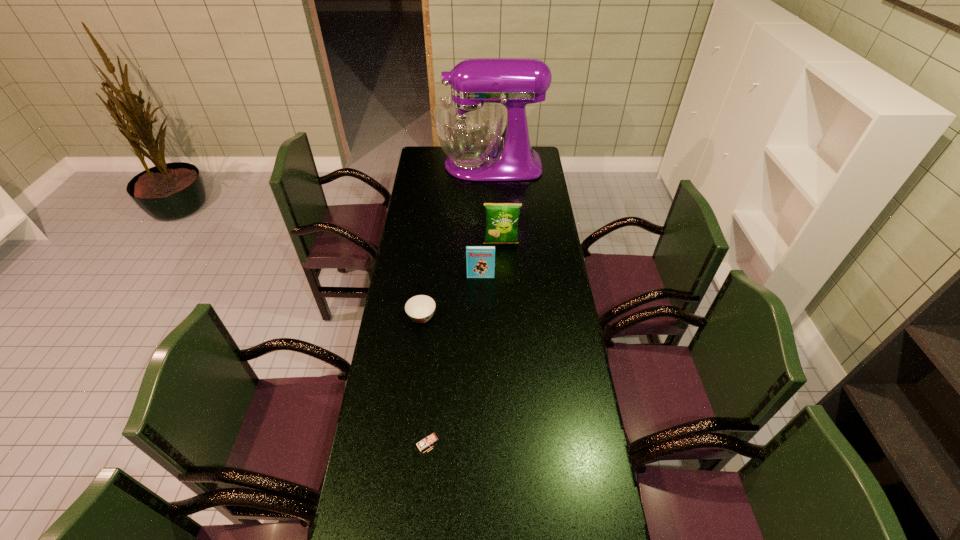
You are a GUI agent. You are given a task and a screenshot of the screen. Output one action in this format:
    pyautogui.click(x=<x>, y=<y>)
    Task: Click on the free location located 0.100m at the bowl opening of the farthest object
    Image resolution: width=960 pixels, height=540 pixels.
    Given the screenshot: What is the action you would take?
    pyautogui.click(x=420, y=165)

The width and height of the screenshot is (960, 540). Identify the location of free point located 0.090m at the bowl opening of the farthest object. (421, 165).

The width and height of the screenshot is (960, 540). I want to click on free space located on the front-facing side of the fourth nearest object, so click(x=503, y=288).

This screenshot has width=960, height=540. In order to click on vacant space located 0.120m on the front cover of the third shortest object in this screenshot , I will do `click(481, 299)`.

Where is `vacant position located on the left of the matchbox`? vacant position located on the left of the matchbox is located at coordinates (397, 443).

Locate an element on the screen. Image resolution: width=960 pixels, height=540 pixels. vacant space located on the right of the fourth farthest object is located at coordinates pyautogui.click(x=498, y=318).

Locate an element on the screen. object positioned at the far edge is located at coordinates (469, 124).

The width and height of the screenshot is (960, 540). In order to click on mixer present at the left edge in this screenshot , I will do `click(469, 124)`.

Identify the location of soup bowl located in the left edge section of the desktop. (420, 308).

The width and height of the screenshot is (960, 540). I want to click on object located at the right edge, so click(x=469, y=124).